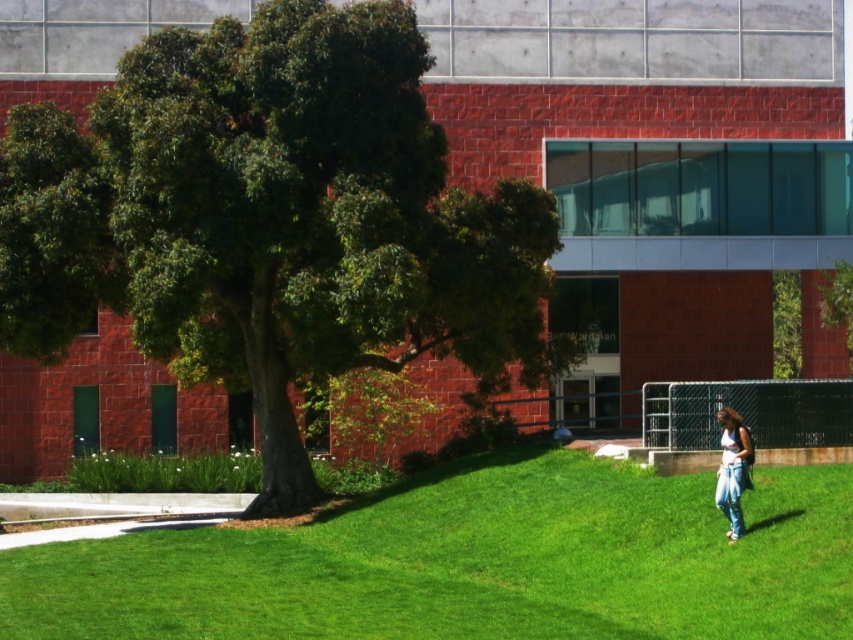
Question: Which point appears closest to the camera in this image?

Choices:
 (A) (10, 241)
 (B) (722, 417)

Answer: (B)

Question: Which point appears closest to the camera in this image?

Choices:
 (A) (241, 248)
 (B) (740, 440)

Answer: (B)

Question: Does green leafy tree at center come in front of jeans at lower right?

Choices:
 (A) yes
 (B) no

Answer: (B)

Question: Is green leafy tree at center positioned at the back of jeans at lower right?

Choices:
 (A) no
 (B) yes

Answer: (B)

Question: Does green leafy tree at center have a lesser width compared to jeans at lower right?

Choices:
 (A) no
 (B) yes

Answer: (A)